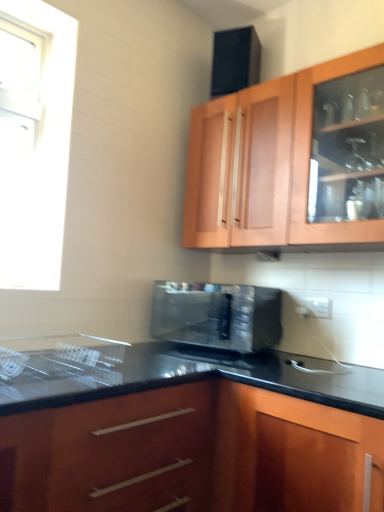
Question: Is glossy wood cabinet at lower center, the first cabinetry when ordered from bottom to top, inside the boundaries of wooden cabinet at upper center, acting as the 2th cabinetry starting from the bottom, or outside?

Choices:
 (A) inside
 (B) outside

Answer: (B)

Question: In terms of height, does glossy wood cabinet at lower center, which is the 2th cabinetry from top to bottom, look taller or shorter compared to wooden cabinet at upper center, acting as the 2th cabinetry starting from the bottom?

Choices:
 (A) tall
 (B) short

Answer: (A)

Question: Which object is positioned closest to the white glossy window at upper left?

Choices:
 (A) satin black microwave at center
 (B) glossy wood cabinet at lower center, the first cabinetry when ordered from bottom to top
 (C) wooden cabinet at upper center, acting as the 2th cabinetry starting from the bottom

Answer: (A)

Question: Which object is the farthest from the glossy wood cabinet at lower center, the first cabinetry when ordered from bottom to top?

Choices:
 (A) white glossy window at upper left
 (B) wooden cabinet at upper center, acting as the 2th cabinetry starting from the bottom
 (C) satin black microwave at center

Answer: (A)